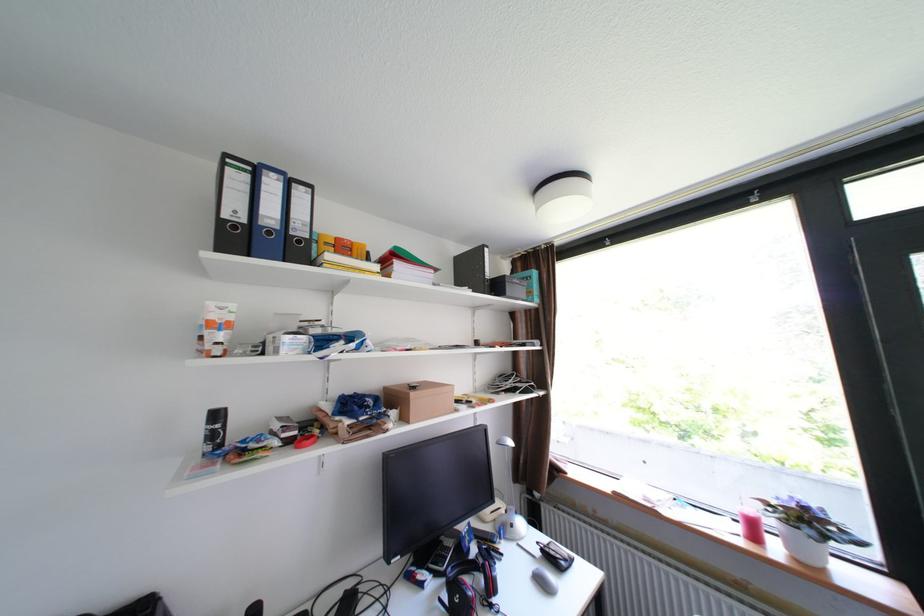
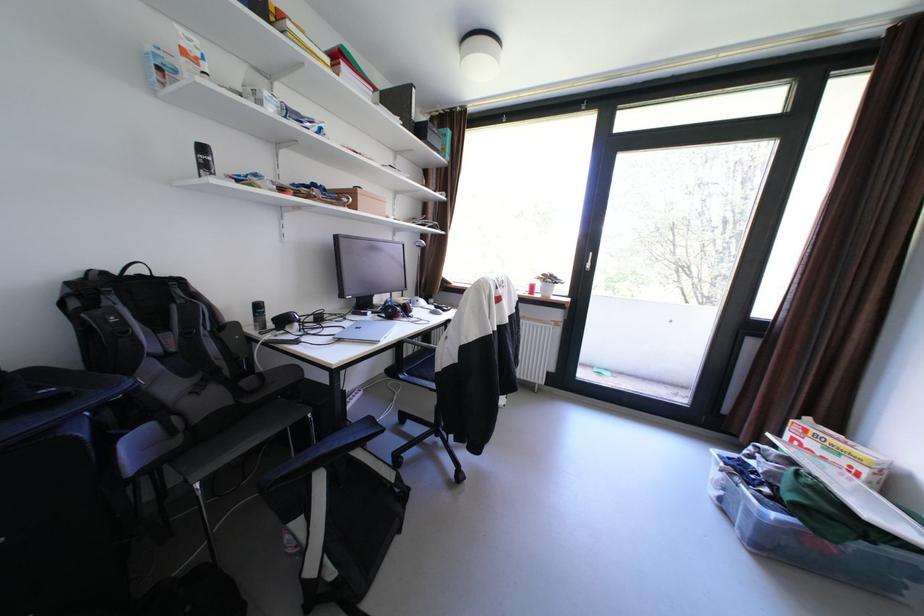
Where in the second image is the point corresponding to (552,583) from the first image?

(444, 314)